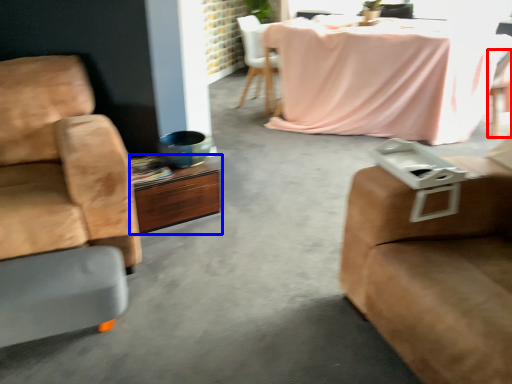
Question: Which point is further to the camera, chair (highlighted by a red box) or desk (highlighted by a blue box)?

Choices:
 (A) chair
 (B) desk

Answer: (A)